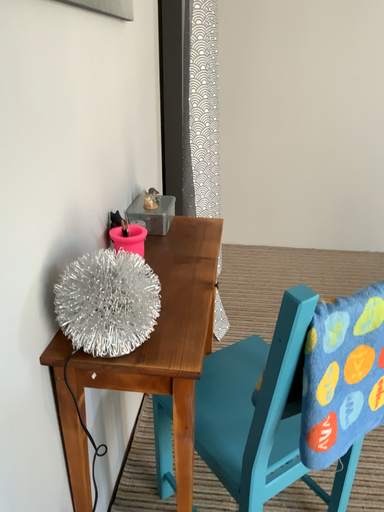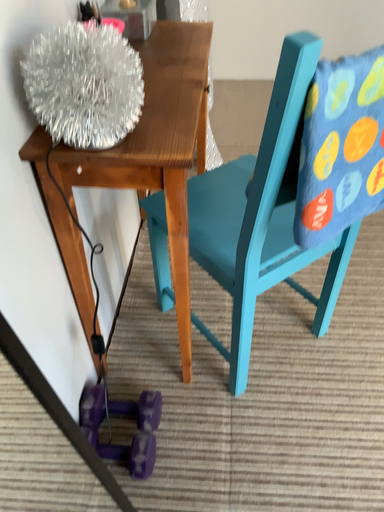
Question: Which way did the camera rotate in the video?

Choices:
 (A) rotated downward
 (B) rotated upward

Answer: (A)